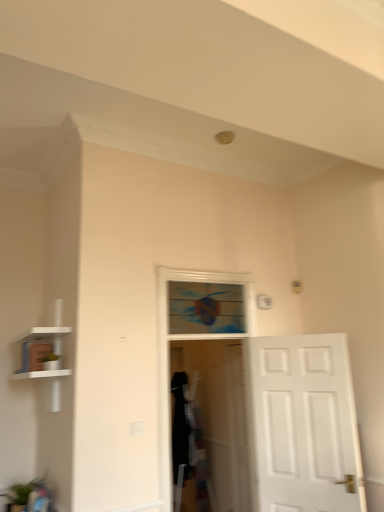
Question: In the image, is wooden stained window at center positioned in front of or behind transparent plastic screen door at center?

Choices:
 (A) behind
 (B) front

Answer: (A)

Question: Considering the positions of point (240, 289) and point (195, 356), is point (240, 289) closer or farther from the camera than point (195, 356)?

Choices:
 (A) closer
 (B) farther

Answer: (A)

Question: Which object is the farthest from the white matte bookshelf at left?

Choices:
 (A) white matte door at center
 (B) transparent plastic screen door at center
 (C) wooden stained window at center

Answer: (B)

Question: Which object is positioned closest to the white matte bookshelf at left?

Choices:
 (A) transparent plastic screen door at center
 (B) wooden stained window at center
 (C) white matte door at center

Answer: (B)